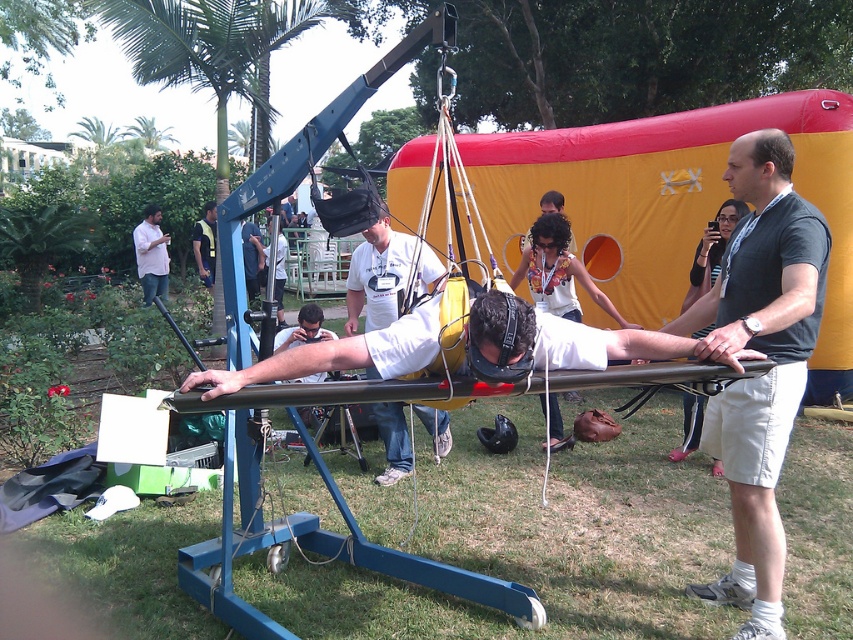
Question: Which object is farther from the camera taking this photo?

Choices:
 (A) white matte/soft fabric at center
 (B) white shirt at upper left

Answer: (B)

Question: Based on their relative distances, which object is farther from the white fabric shirt at center?

Choices:
 (A) white matte shirt at center
 (B) black matte shirt at upper right
 (C) white shirt at upper left
 (D) dark blue shirt at center

Answer: (B)

Question: In this image, where is white shirt at upper left located relative to white fabric shirt at center?

Choices:
 (A) below
 (B) above

Answer: (B)

Question: Which object is the closest to the black matte shirt at upper right?

Choices:
 (A) dark blue shirt at center
 (B) white fabric shirt at center
 (C) white matte/soft fabric at center

Answer: (C)

Question: Can you confirm if dark blue shirt at center is thinner than white fabric shirt at center?

Choices:
 (A) yes
 (B) no

Answer: (B)

Question: Can you confirm if white shirt at upper left is positioned below white fabric shirt at center?

Choices:
 (A) yes
 (B) no

Answer: (B)